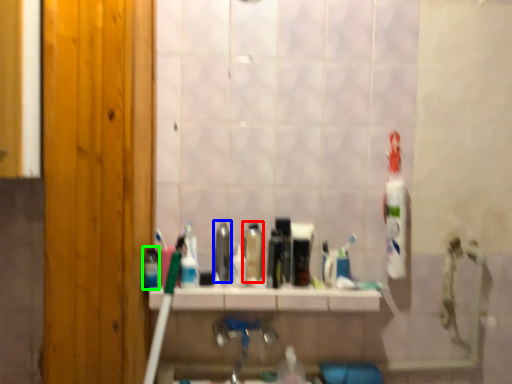
Question: Which object is the farthest from mouthwash (highlighted by a red box)? Choose among these: mouthwash (highlighted by a blue box) or mouthwash (highlighted by a green box).

Choices:
 (A) mouthwash
 (B) mouthwash

Answer: (B)